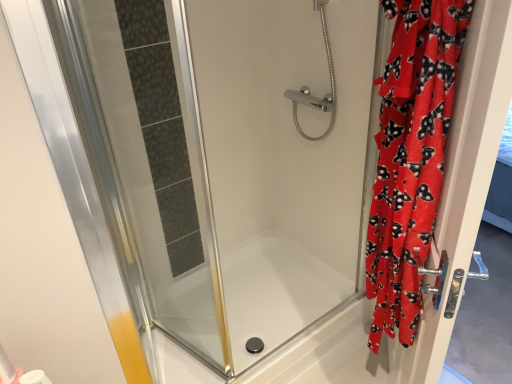
Question: Does transparent glass bathtub at center have a lesser width compared to white matte toilet paper at lower left?

Choices:
 (A) no
 (B) yes

Answer: (A)

Question: From the image's perspective, is transparent glass bathtub at center above white matte toilet paper at lower left?

Choices:
 (A) no
 (B) yes

Answer: (A)

Question: Is the position of transparent glass bathtub at center more distant than that of white matte toilet paper at lower left?

Choices:
 (A) yes
 (B) no

Answer: (A)

Question: From a real-world perspective, is transparent glass bathtub at center beneath white matte toilet paper at lower left?

Choices:
 (A) yes
 (B) no

Answer: (A)

Question: From a real-world perspective, is transparent glass bathtub at center on white matte toilet paper at lower left?

Choices:
 (A) no
 (B) yes

Answer: (A)

Question: From the image's perspective, relative to transparent glass bathtub at center, is red velvet curtain at right above or below?

Choices:
 (A) below
 (B) above

Answer: (B)

Question: Based on their positions, is red velvet curtain at right located to the left or right of transparent glass bathtub at center?

Choices:
 (A) right
 (B) left

Answer: (A)

Question: From a real-world perspective, relative to transparent glass bathtub at center, is red velvet curtain at right vertically above or below?

Choices:
 (A) below
 (B) above

Answer: (B)

Question: In terms of height, does red velvet curtain at right look taller or shorter compared to transparent glass bathtub at center?

Choices:
 (A) tall
 (B) short

Answer: (A)

Question: In terms of height, does white matte toilet paper at lower left look taller or shorter compared to chrome metallic showerhead at upper center?

Choices:
 (A) tall
 (B) short

Answer: (B)

Question: Considering the positions of white matte toilet paper at lower left and chrome metallic showerhead at upper center in the image, is white matte toilet paper at lower left bigger or smaller than chrome metallic showerhead at upper center?

Choices:
 (A) big
 (B) small

Answer: (B)

Question: Would you say white matte toilet paper at lower left is inside or outside chrome metallic showerhead at upper center?

Choices:
 (A) inside
 (B) outside

Answer: (B)

Question: Is white matte toilet paper at lower left wider or thinner than chrome metallic showerhead at upper center?

Choices:
 (A) wide
 (B) thin

Answer: (B)

Question: Is white matte toilet paper at lower left to the left or to the right of velvet red robe at right, which appears as the first screen door when viewed from the right, in the image?

Choices:
 (A) right
 (B) left

Answer: (B)

Question: In terms of width, does white matte toilet paper at lower left look wider or thinner when compared to velvet red robe at right, which appears as the first screen door when viewed from the right?

Choices:
 (A) thin
 (B) wide

Answer: (A)